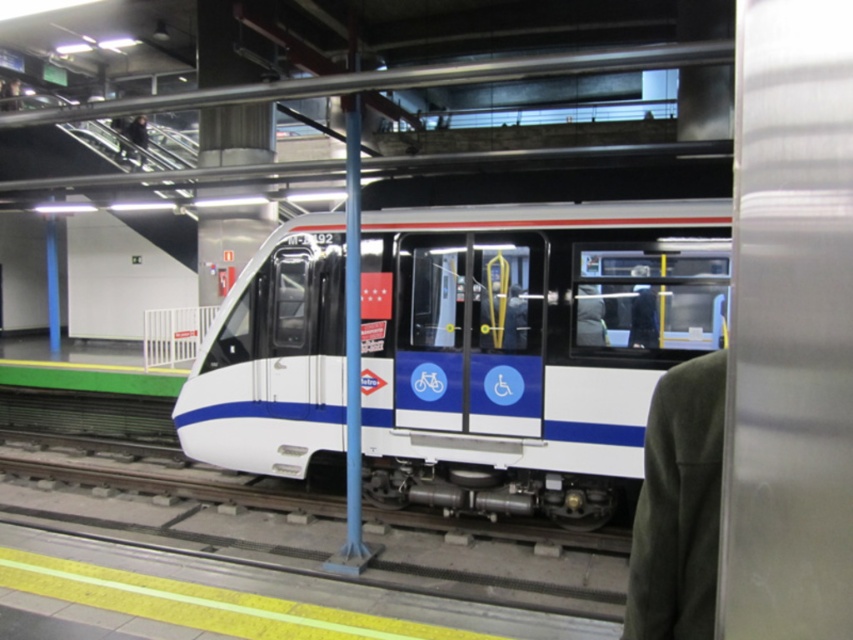
You are a passenger standing on the platform at the modern metro station. You notice the white glossy train at center. Based on its position, can you estimate where it is most likely located in relation to the platform?

The white glossy train at center is positioned at coordinates approximately 0.545 on the x and 0.618 on the y axis, meaning it is centrally aligned along the platform and slightly closer to the front section of the platform.

You are a passenger waiting on the platform and see a green wool coat at right and a dark gray suit at center. Which person is standing closer to you?

The green wool coat at right is closer to the viewer than the dark gray suit at center, so the person wearing the green wool coat at right is standing closer to you.